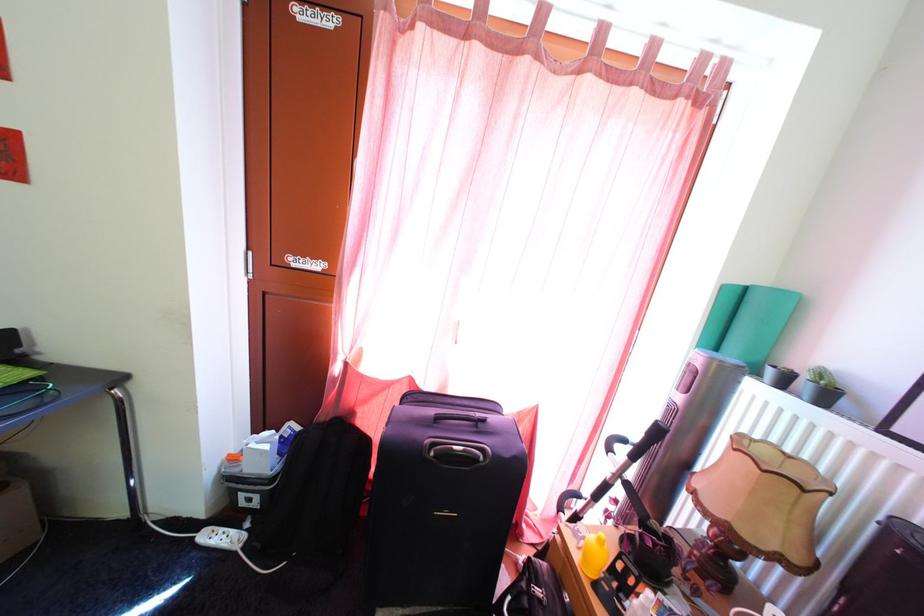
Find where to lift the rolled teal mat. Please return your answer as a coordinate pair (x, y).

(747, 322)